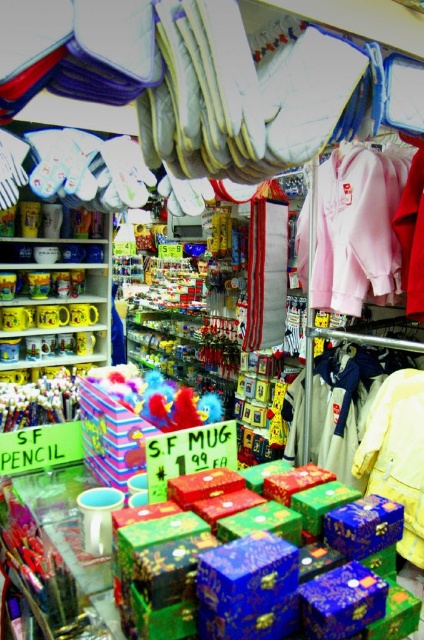
Question: Which is nearer to the white cotton jacket at center?

Choices:
 (A) pink fleece hoodie at upper right
 (B) matte plastic pencils at left
 (C) pink fabric sweatshirt at upper right

Answer: (C)

Question: Estimate the real-world distances between objects in this image. Which object is farther from the white cotton jacket at center?

Choices:
 (A) shiny metallic boxes at center
 (B) pink fabric sweatshirt at upper right

Answer: (A)

Question: Can you confirm if white cotton jacket at center is positioned above matte plastic pencils at left?

Choices:
 (A) yes
 (B) no

Answer: (B)

Question: Does pink fabric sweatshirt at upper right appear on the right side of matte plastic pencils at left?

Choices:
 (A) yes
 (B) no

Answer: (A)

Question: Among these objects, which one is farthest from the camera?

Choices:
 (A) white cotton jacket at center
 (B) matte plastic pencils at left
 (C) pink fabric sweatshirt at upper right

Answer: (C)

Question: Does shiny metallic boxes at center have a lesser width compared to matte plastic pencils at left?

Choices:
 (A) no
 (B) yes

Answer: (A)